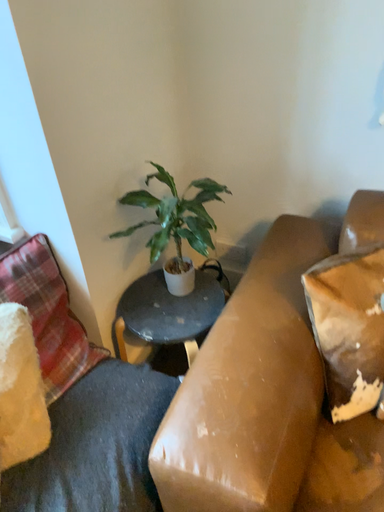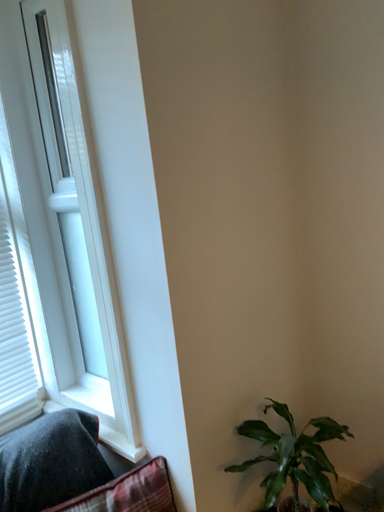
Question: Which way did the camera rotate in the video?

Choices:
 (A) rotated right
 (B) rotated left

Answer: (B)